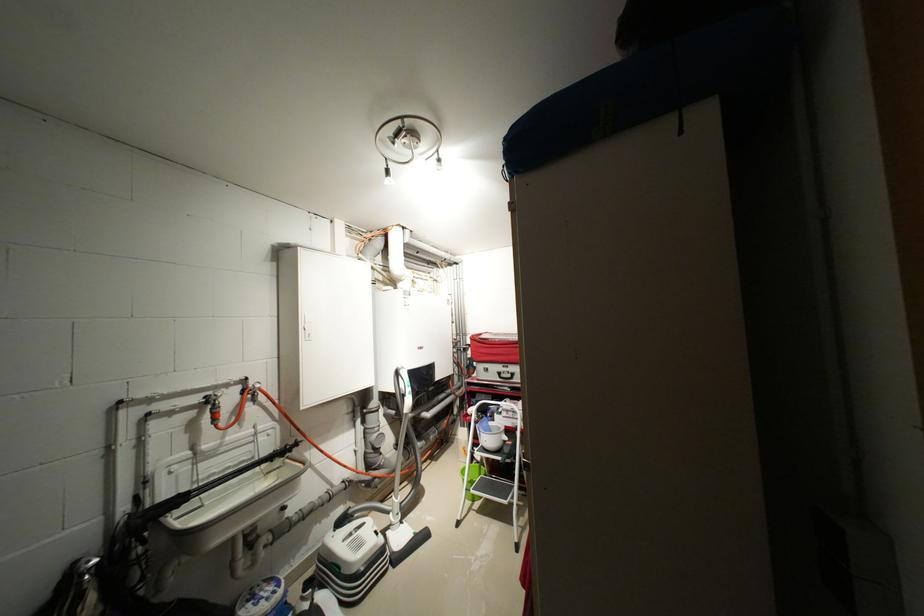
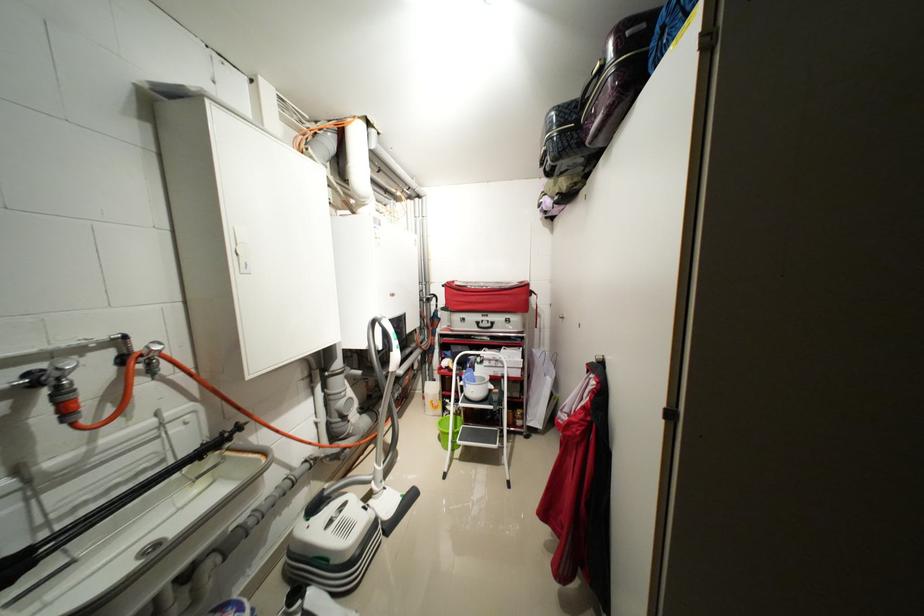
Where in the second image is the point corresponding to [517,377] from the first image?

(496, 326)